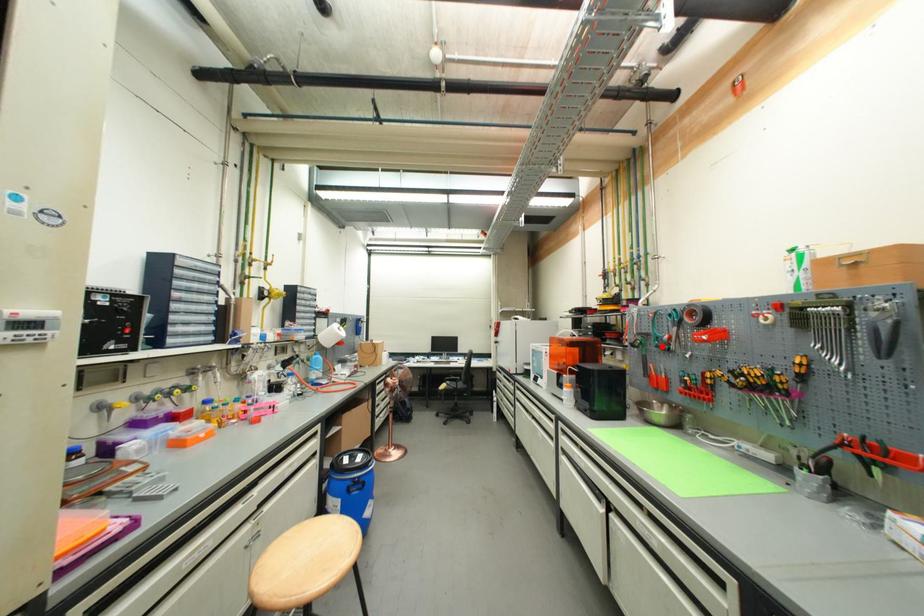
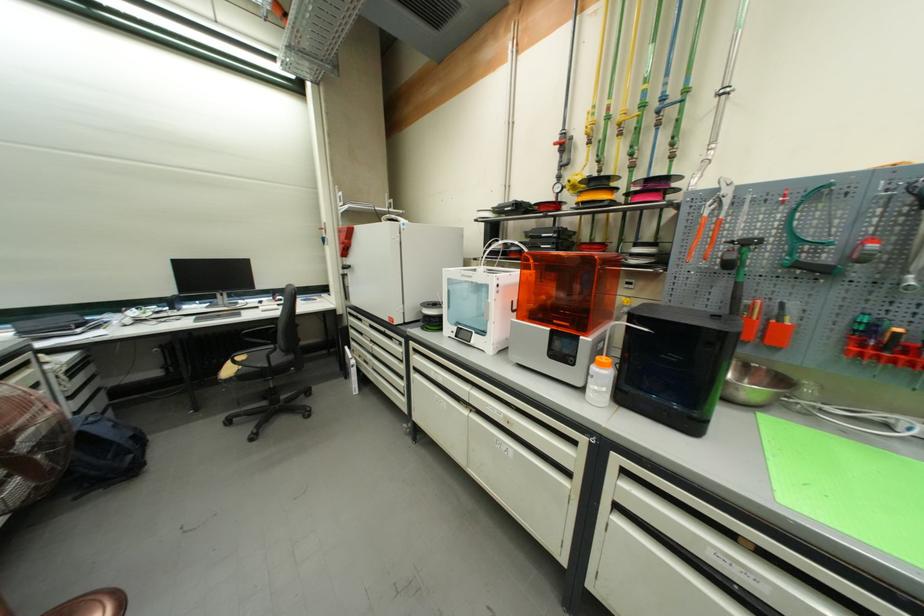
Where in the second image is the point corresponding to the highlighted location from the first image?

(803, 262)